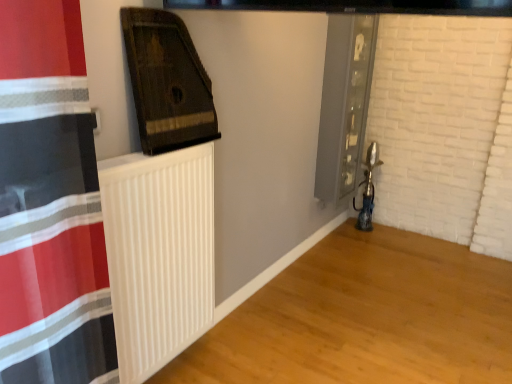
Find the location of a particular element. The image size is (512, 384). vacant space underneath dark brown wood at upper left, placed as the second wood when sorted from bottom to top (from a real-world perspective) is located at coordinates (184, 147).